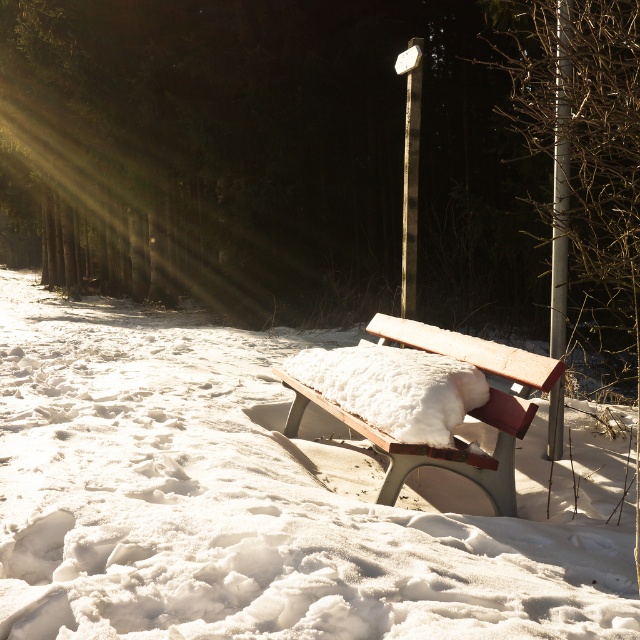
Can you confirm if white fluffy snow at center is taller than metallic pole at upper center?

No, white fluffy snow at center is not taller than metallic pole at upper center.

Does white fluffy snow at center have a lesser height compared to metallic pole at upper center?

Indeed, white fluffy snow at center has a lesser height compared to metallic pole at upper center.

Identify the location of white fluffy snow at center. The width and height of the screenshot is (640, 640). (259, 500).

Can you confirm if metallic pole at right is bigger than metallic pole at upper center?

Correct, metallic pole at right is larger in size than metallic pole at upper center.

The image size is (640, 640). What do you see at coordinates (561, 182) in the screenshot?
I see `metallic pole at right` at bounding box center [561, 182].

This screenshot has height=640, width=640. Identify the location of metallic pole at right. (561, 182).

Is white fluffy snow at center smaller than metallic pole at right?

No, white fluffy snow at center is not smaller than metallic pole at right.

Is point (211, 493) positioned in front of point (560, 172)?

Yes, it is.

The image size is (640, 640). I want to click on white fluffy snow at center, so click(x=259, y=500).

The width and height of the screenshot is (640, 640). In order to click on white fluffy snow at center in this screenshot , I will do `click(259, 500)`.